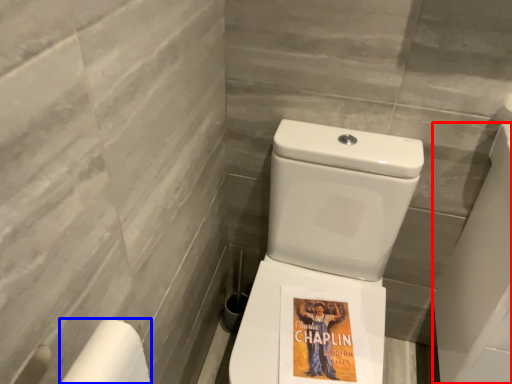
Question: Which object is closer to the camera taking this photo, porcelain (highlighted by a red box) or toilet paper (highlighted by a blue box)?

Choices:
 (A) porcelain
 (B) toilet paper

Answer: (B)